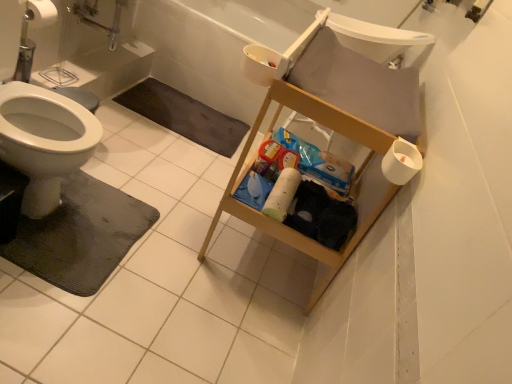
Question: Considering the relative sizes of white plastic sink at upper right and black rubber bath mat at lower left, placed as the first bath mat when sorted from top to bottom, in the image provided, is white plastic sink at upper right wider than black rubber bath mat at lower left, placed as the first bath mat when sorted from top to bottom,?

Choices:
 (A) no
 (B) yes

Answer: (A)

Question: Is white plastic sink at upper right at the right side of black rubber bath mat at lower left, placed as the first bath mat when sorted from top to bottom?

Choices:
 (A) yes
 (B) no

Answer: (A)

Question: From a real-world perspective, is white plastic sink at upper right located higher than black rubber bath mat at lower left, acting as the 2th bath mat starting from the bottom?

Choices:
 (A) no
 (B) yes

Answer: (B)

Question: From the image's perspective, is white plastic sink at upper right above black rubber bath mat at lower left, placed as the first bath mat when sorted from top to bottom?

Choices:
 (A) yes
 (B) no

Answer: (A)

Question: Is white plastic sink at upper right positioned in front of black rubber bath mat at lower left, the first bath mat viewed from the back?

Choices:
 (A) no
 (B) yes

Answer: (B)

Question: Considering the positions of white plastic bathtub at upper center and white matte toilet paper at right, placed as the second toilet paper when sorted from back to front, in the image, is white plastic bathtub at upper center wider or thinner than white matte toilet paper at right, placed as the second toilet paper when sorted from back to front,?

Choices:
 (A) wide
 (B) thin

Answer: (A)

Question: From the image's perspective, is white plastic bathtub at upper center located above or below white matte toilet paper at right, arranged as the second toilet paper when viewed from the left?

Choices:
 (A) above
 (B) below

Answer: (A)

Question: From their relative heights in the image, would you say white plastic bathtub at upper center is taller or shorter than white matte toilet paper at right, placed as the second toilet paper when sorted from back to front?

Choices:
 (A) tall
 (B) short

Answer: (A)

Question: Does point (x=253, y=87) appear closer or farther from the camera than point (x=391, y=147)?

Choices:
 (A) farther
 (B) closer

Answer: (A)

Question: Would you say white plastic sink at upper right is to the left or to the right of black rubber bath mat at lower left, acting as the 2th bath mat starting from the bottom, in the picture?

Choices:
 (A) right
 (B) left

Answer: (A)

Question: From the image's perspective, is white plastic sink at upper right located above or below black rubber bath mat at lower left, acting as the 2th bath mat starting from the bottom?

Choices:
 (A) above
 (B) below

Answer: (A)

Question: Is point (397, 49) positioned closer to the camera than point (234, 142)?

Choices:
 (A) closer
 (B) farther

Answer: (A)

Question: Is white plastic sink at upper right in front of or behind black rubber bath mat at lower left, placed as the first bath mat when sorted from top to bottom, in the image?

Choices:
 (A) front
 (B) behind

Answer: (A)

Question: From the image's perspective, is black rubber bath mat at lower left, acting as the 2th bath mat starting from the front, above or below white matte toilet paper at center, placed as the 2th toilet paper when sorted from right to left?

Choices:
 (A) above
 (B) below

Answer: (A)

Question: Would you say black rubber bath mat at lower left, placed as the first bath mat when sorted from top to bottom, is to the left or to the right of white matte toilet paper at center, the 2th toilet paper in the front-to-back sequence, in the picture?

Choices:
 (A) left
 (B) right

Answer: (A)